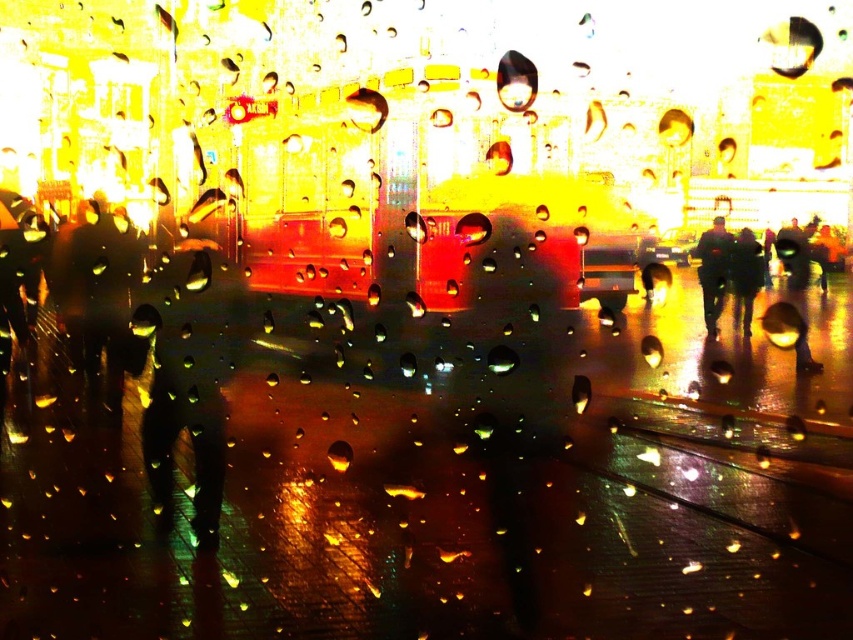
Question: Which point is closer to the camera?

Choices:
 (A) dark blue jacket at center
 (B) dark gray fabric jacket at center

Answer: (B)

Question: Is dark blue jacket at center bigger than dark gray fabric jacket at center?

Choices:
 (A) no
 (B) yes

Answer: (B)

Question: Can you confirm if dark blue jacket at center is thinner than dark gray fabric jacket at center?

Choices:
 (A) yes
 (B) no

Answer: (B)

Question: Does dark blue jacket at center have a larger size compared to dark gray fabric jacket at center?

Choices:
 (A) yes
 (B) no

Answer: (A)